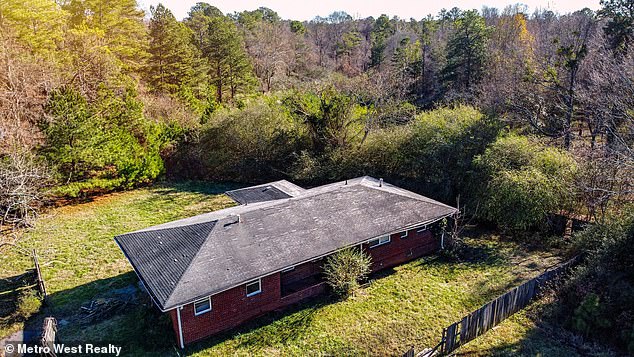
This screenshot has height=357, width=634. I want to click on wall, so click(230, 310).